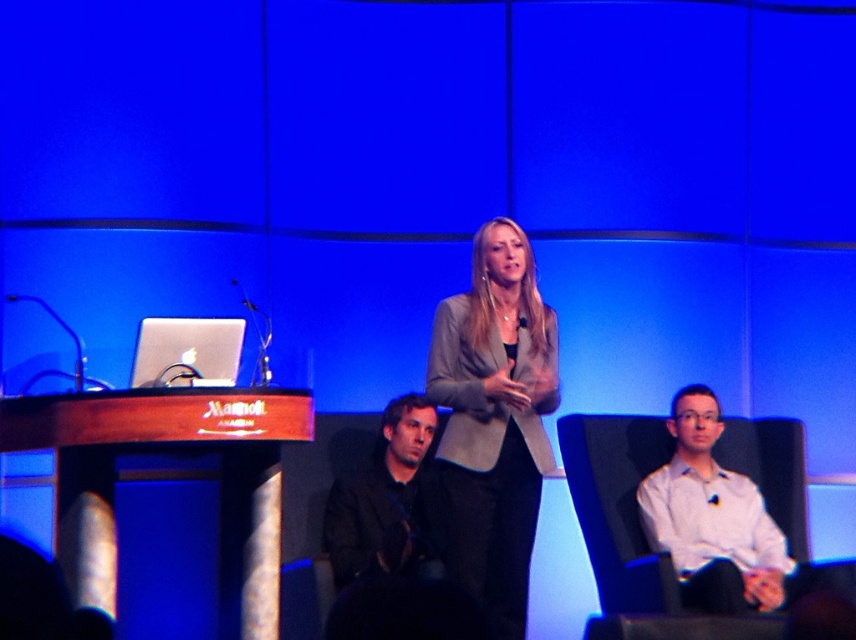
Question: Is white shirt at right in front of black matte jacket at center?

Choices:
 (A) yes
 (B) no

Answer: (A)

Question: Which of these objects is positioned farthest from the white shirt at right?

Choices:
 (A) matte gray blazer at center
 (B) black matte jacket at center

Answer: (B)

Question: Does matte gray blazer at center have a greater width compared to black matte jacket at center?

Choices:
 (A) no
 (B) yes

Answer: (B)

Question: Does white shirt at right have a smaller size compared to black matte jacket at center?

Choices:
 (A) no
 (B) yes

Answer: (A)

Question: Among these objects, which one is farthest from the camera?

Choices:
 (A) black matte jacket at center
 (B) white shirt at right
 (C) matte gray blazer at center

Answer: (A)

Question: Among these points, which one is nearest to the camera?

Choices:
 (A) (376, 547)
 (B) (693, 604)

Answer: (B)